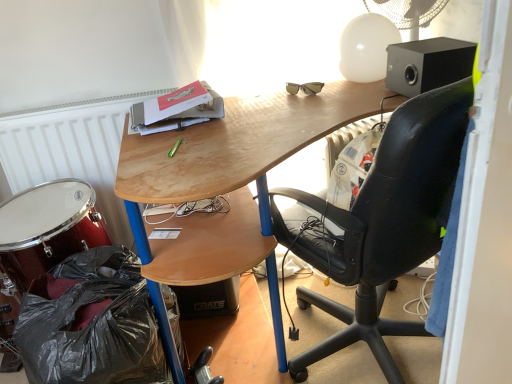
Question: Is black plastic bag at lower left at the left side of black leather chair at upper right?

Choices:
 (A) no
 (B) yes

Answer: (B)

Question: Is black plastic bag at lower left shorter than black leather chair at upper right?

Choices:
 (A) yes
 (B) no

Answer: (A)

Question: Is black leather chair at upper right a part of black plastic bag at lower left?

Choices:
 (A) no
 (B) yes

Answer: (A)

Question: Considering the relative sizes of black plastic bag at lower left and black leather chair at upper right in the image provided, is black plastic bag at lower left taller than black leather chair at upper right?

Choices:
 (A) yes
 (B) no

Answer: (B)

Question: From the image's perspective, is black plastic bag at lower left over black leather chair at upper right?

Choices:
 (A) no
 (B) yes

Answer: (A)

Question: Visually, is black plastic bag at lower left positioned to the left or to the right of white plastic mechanical fan at upper right?

Choices:
 (A) right
 (B) left

Answer: (B)

Question: In terms of height, does black plastic bag at lower left look taller or shorter compared to white plastic mechanical fan at upper right?

Choices:
 (A) short
 (B) tall

Answer: (B)

Question: In the image, is black plastic bag at lower left positioned in front of or behind white plastic mechanical fan at upper right?

Choices:
 (A) behind
 (B) front

Answer: (B)

Question: From the image's perspective, is black plastic bag at lower left positioned above or below white plastic mechanical fan at upper right?

Choices:
 (A) above
 (B) below

Answer: (B)

Question: Is wooden desk at upper center in front of or behind matte black speaker at upper right in the image?

Choices:
 (A) behind
 (B) front

Answer: (B)

Question: Does point (130, 160) appear closer or farther from the camera than point (428, 46)?

Choices:
 (A) farther
 (B) closer

Answer: (B)

Question: Is wooden desk at upper center taller or shorter than matte black speaker at upper right?

Choices:
 (A) short
 (B) tall

Answer: (B)

Question: Based on their sizes in the image, would you say wooden desk at upper center is bigger or smaller than matte black speaker at upper right?

Choices:
 (A) small
 (B) big

Answer: (B)

Question: Based on their sizes in the image, would you say white plastic mechanical fan at upper right is bigger or smaller than black plastic bag at lower left?

Choices:
 (A) small
 (B) big

Answer: (A)

Question: In terms of width, does white plastic mechanical fan at upper right look wider or thinner when compared to black plastic bag at lower left?

Choices:
 (A) wide
 (B) thin

Answer: (B)